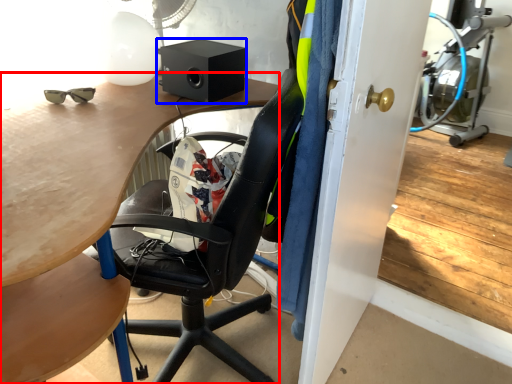
Question: Which object is further to the camera taking this photo, desk (highlighted by a red box) or loudspeaker (highlighted by a blue box)?

Choices:
 (A) desk
 (B) loudspeaker

Answer: (B)